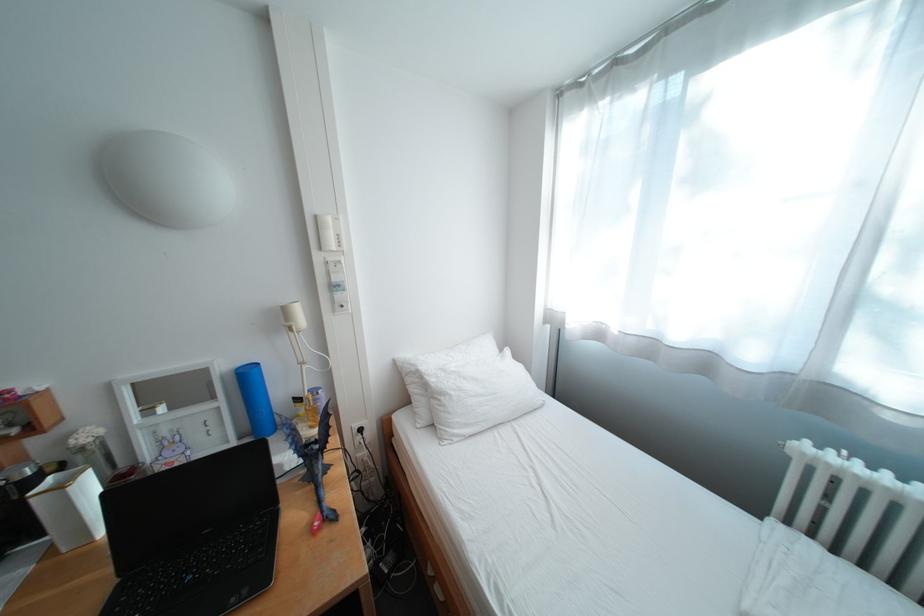
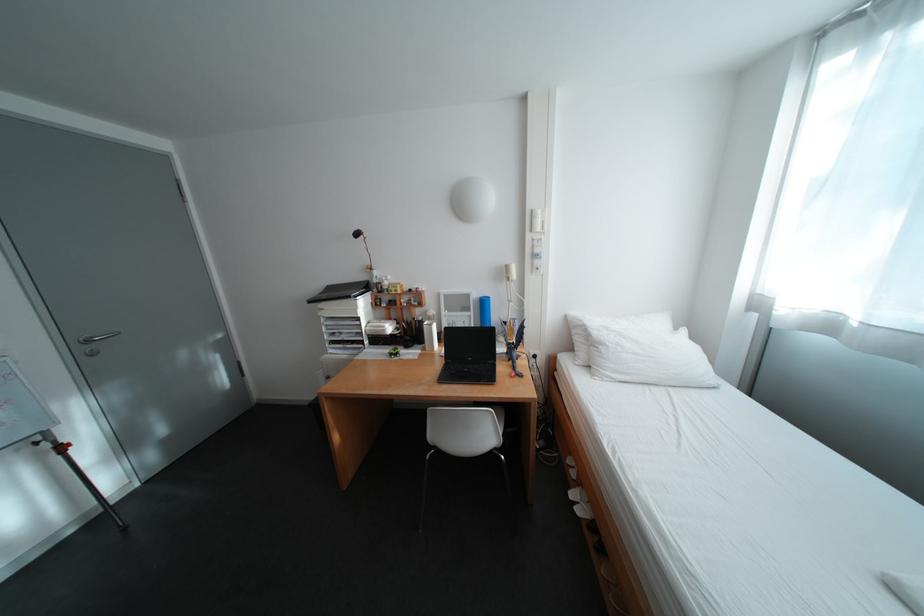
The point at (30,498) is marked in the first image. Where is the corresponding point in the second image?

(430, 326)